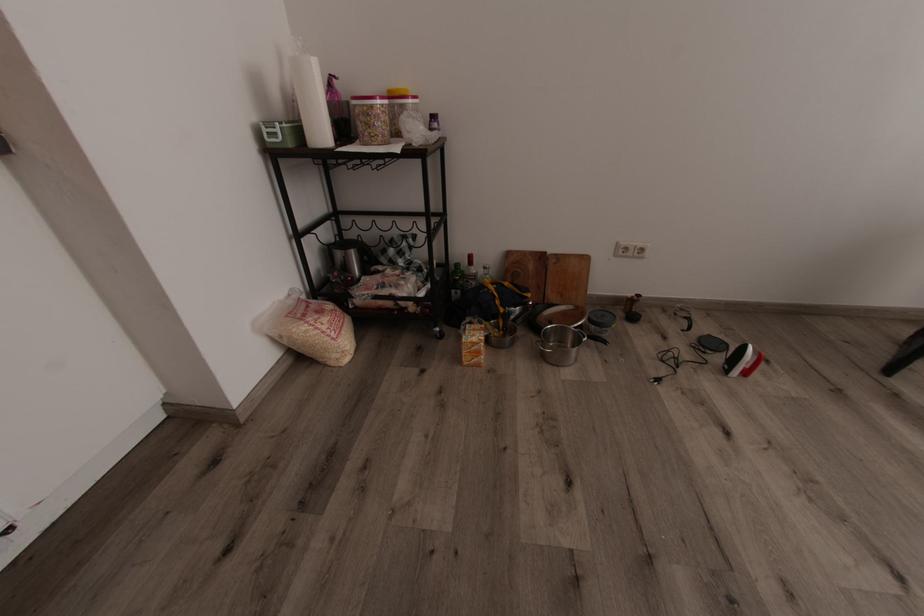
Which object does [456,281] point to?

It corresponds to the green glass bottle in the image.